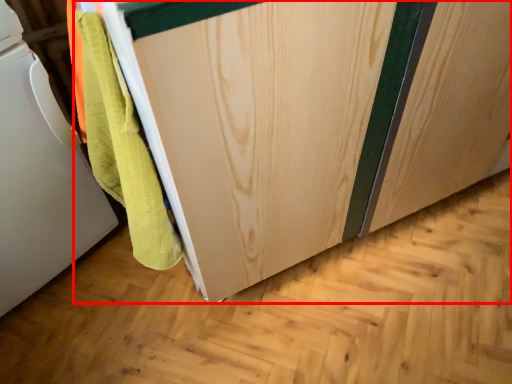
Question: Considering the relative positions of cabinetry (annotated by the red box) and home appliance in the image provided, where is cabinetry (annotated by the red box) located with respect to the staircase?

Choices:
 (A) right
 (B) left

Answer: (A)